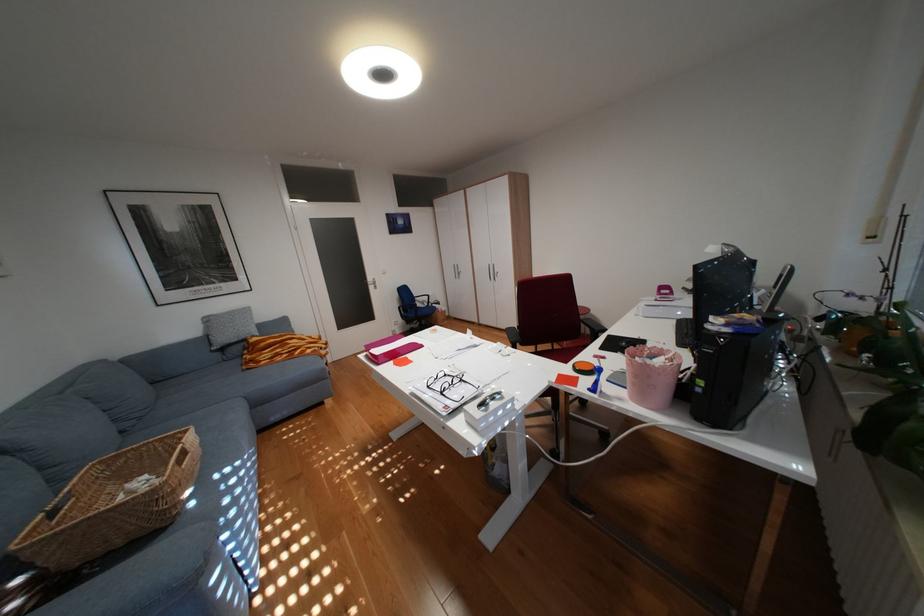
Image resolution: width=924 pixels, height=616 pixels. I want to click on white rectangular box, so click(x=487, y=408).